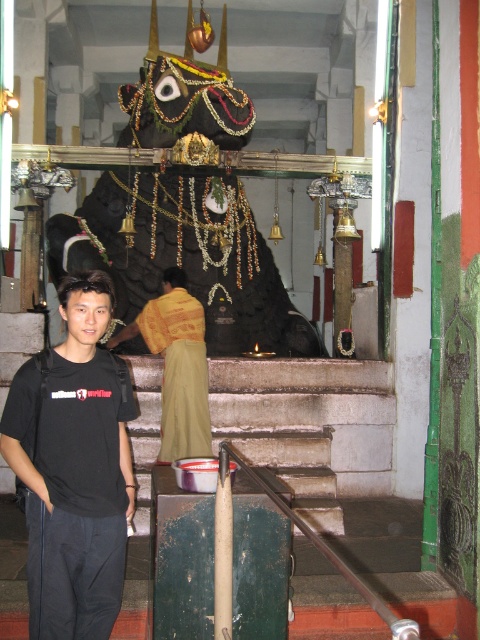
Question: In this image, where is black cotton shirt at lower left located relative to yellow textured cloth at center?

Choices:
 (A) left
 (B) right

Answer: (A)

Question: Which object is closer to the camera taking this photo?

Choices:
 (A) black cotton shirt at lower left
 (B) yellow textured cloth at center

Answer: (A)

Question: Observing the image, what is the correct spatial positioning of black cotton shirt at lower left in reference to yellow textured cloth at center?

Choices:
 (A) above
 (B) below

Answer: (B)

Question: Can you confirm if black cotton shirt at lower left is bigger than yellow textured cloth at center?

Choices:
 (A) no
 (B) yes

Answer: (A)

Question: Among these points, which one is nearest to the camera?

Choices:
 (A) click(x=206, y=451)
 (B) click(x=70, y=630)

Answer: (B)